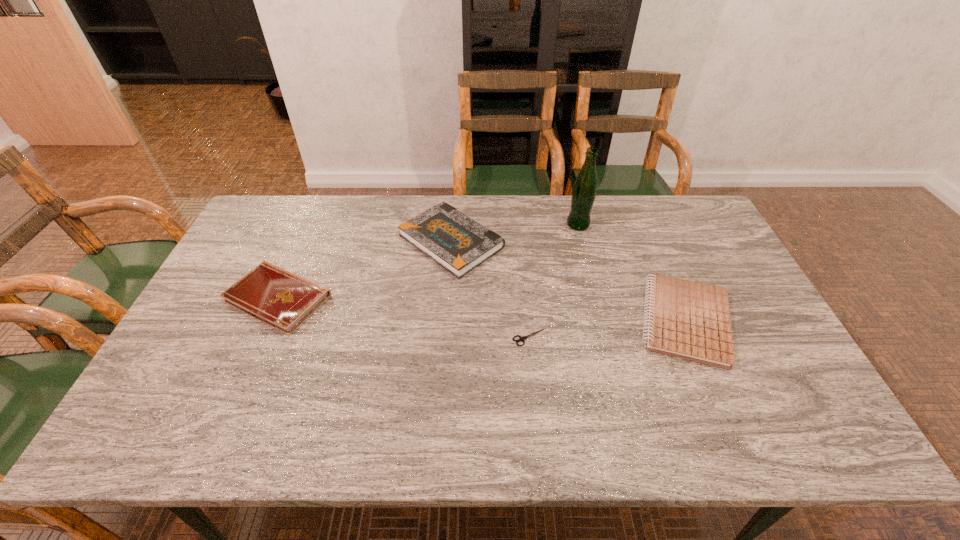
The image size is (960, 540). What are the coordinates of `the second object from right to left` in the screenshot? It's located at (583, 195).

Find the location of a particular element. The width and height of the screenshot is (960, 540). the tallest object is located at coordinates (583, 195).

Find the location of a particular element. the tallest notebook is located at coordinates (459, 244).

Identify the location of the second tallest object. The height and width of the screenshot is (540, 960). (459, 244).

Locate an element on the screen. This screenshot has height=540, width=960. the rightmost notebook is located at coordinates (690, 320).

Where is `the leftmost notebook`? The width and height of the screenshot is (960, 540). the leftmost notebook is located at coordinates (270, 294).

I want to click on the shortest object, so click(521, 339).

This screenshot has height=540, width=960. I want to click on shears, so click(521, 339).

This screenshot has height=540, width=960. I want to click on vacant point located on the front of the fourth object from left to right, so click(x=592, y=280).

Identify the location of free space located 0.070m on the back of the second tallest object. (x=454, y=198).